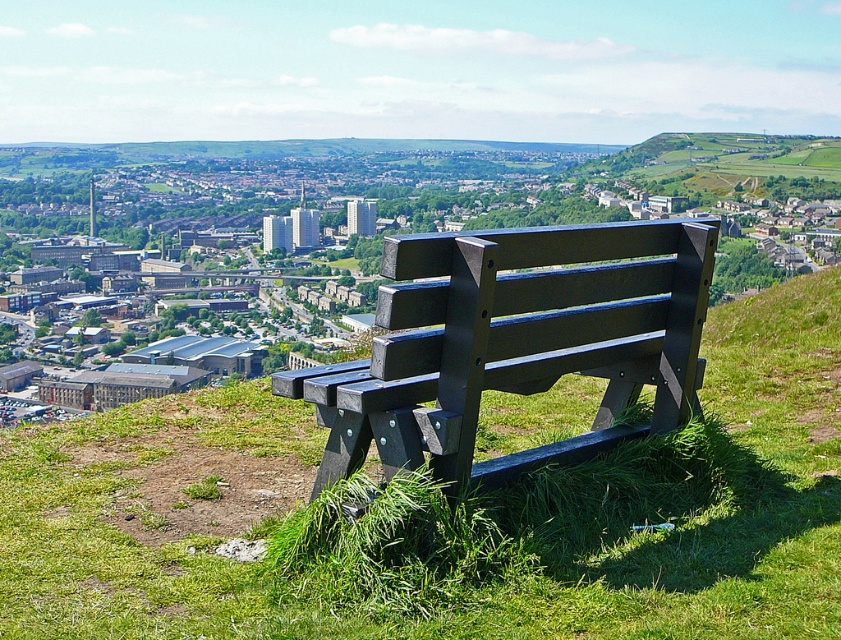
Is green grassy bench at center to the right of matte black bench at center from the viewer's perspective?

Indeed, green grassy bench at center is positioned on the right side of matte black bench at center.

Is point (94, 460) closer to camera compared to point (505, 355)?

That is False.

Where is `green grassy bench at center`? green grassy bench at center is located at coordinates (482, 589).